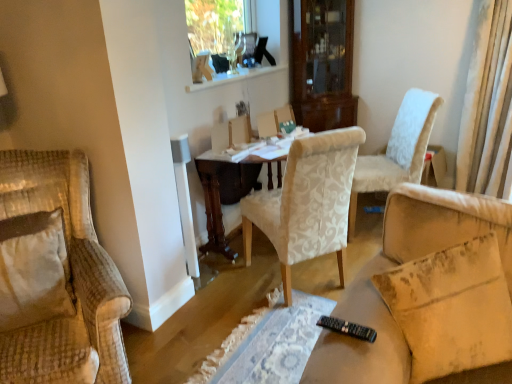
Question: Does clear glass window frame at upper center have a greater height compared to black plastic remote control at lower center?

Choices:
 (A) no
 (B) yes

Answer: (B)

Question: Does clear glass window frame at upper center have a smaller size compared to black plastic remote control at lower center?

Choices:
 (A) yes
 (B) no

Answer: (B)

Question: Is clear glass window frame at upper center wider than black plastic remote control at lower center?

Choices:
 (A) yes
 (B) no

Answer: (B)

Question: Is the depth of clear glass window frame at upper center greater than that of black plastic remote control at lower center?

Choices:
 (A) yes
 (B) no

Answer: (A)

Question: Is clear glass window frame at upper center far away from black plastic remote control at lower center?

Choices:
 (A) yes
 (B) no

Answer: (A)

Question: Is clear glass window frame at upper center looking in the opposite direction of black plastic remote control at lower center?

Choices:
 (A) yes
 (B) no

Answer: (B)

Question: Is black plastic remote control at lower center touching white textured chair at center, the second chair from the left?

Choices:
 (A) yes
 (B) no

Answer: (B)

Question: Is black plastic remote control at lower center smaller than white textured chair at center, the second chair when ordered from right to left?

Choices:
 (A) yes
 (B) no

Answer: (A)

Question: From a real-world perspective, is black plastic remote control at lower center under white textured chair at center, the second chair when ordered from right to left?

Choices:
 (A) yes
 (B) no

Answer: (B)

Question: Can white textured chair at center, the second chair from the left, be found inside black plastic remote control at lower center?

Choices:
 (A) no
 (B) yes

Answer: (A)

Question: Is black plastic remote control at lower center to the right of white textured chair at center, the second chair from the left, from the viewer's perspective?

Choices:
 (A) no
 (B) yes

Answer: (B)

Question: Considering the relative sizes of black plastic remote control at lower center and white textured chair at center, the second chair when ordered from right to left, in the image provided, is black plastic remote control at lower center shorter than white textured chair at center, the second chair when ordered from right to left,?

Choices:
 (A) yes
 (B) no

Answer: (A)

Question: Is velvet beige armchair at left, which is the 3th chair in right-to-left order, facing away from white textured chair at center, the second chair when ordered from right to left?

Choices:
 (A) yes
 (B) no

Answer: (B)